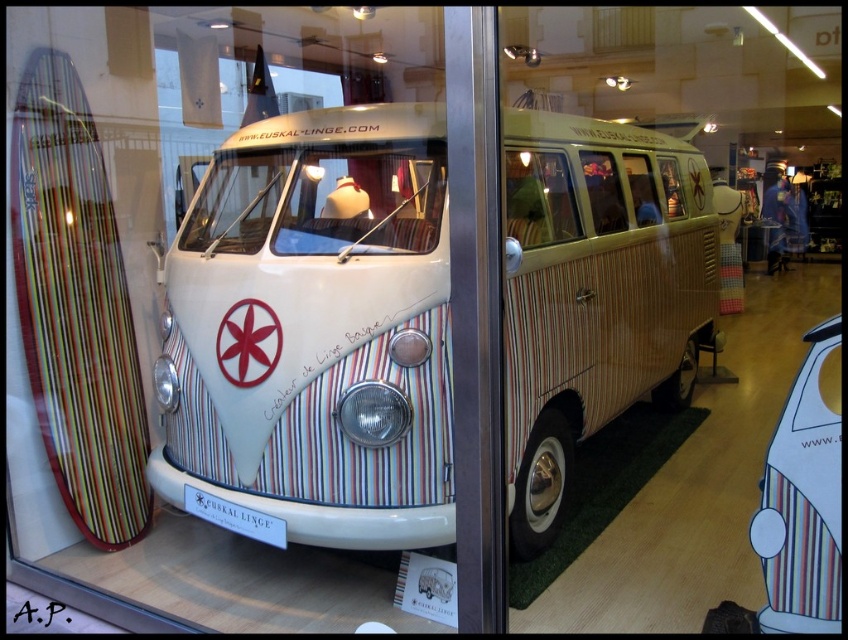
You are a customer in the store and want to know if the white striped van at center can fit through the store entrance. The entrance is just wide enough for the multicolored striped surfboard at left to pass through. Can the van fit through the entrance?

The white striped van at center is wider than the multicolored striped surfboard at left, so it cannot fit through the entrance that only accommodates the surfboard.

You are standing in the retail store where the vintage Volkswagen van is displayed. You see the multicolored striped surfboard at left. If you want to walk from the van to the surfboard, in which direction should you move?

To move from the vintage Volkswagen van to the multicolored striped surfboard at left, you should walk to your left since the surfboard is positioned to the left of the van.